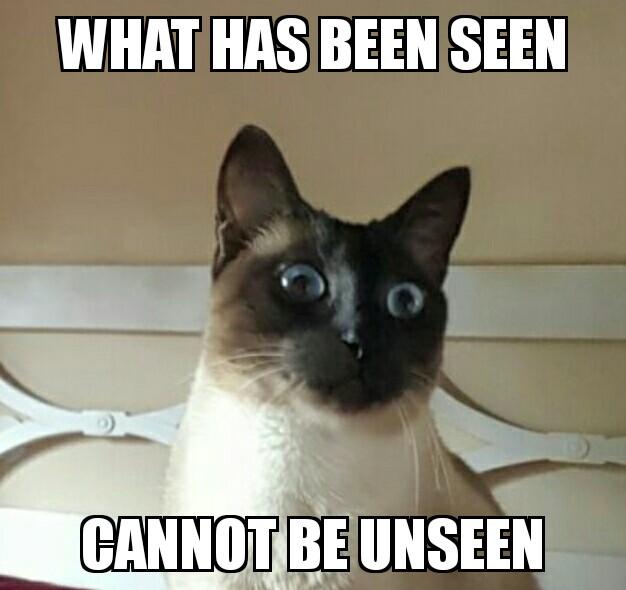
This screenshot has width=626, height=590. What are the coordinates of `frame` in the screenshot? It's located at (48, 427).